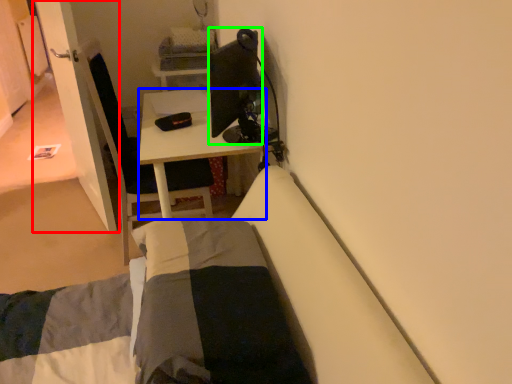
Question: Which object is the farthest from door (highlighted by a red box)? Choose among these: desk (highlighted by a blue box) or television (highlighted by a green box).

Choices:
 (A) desk
 (B) television

Answer: (B)